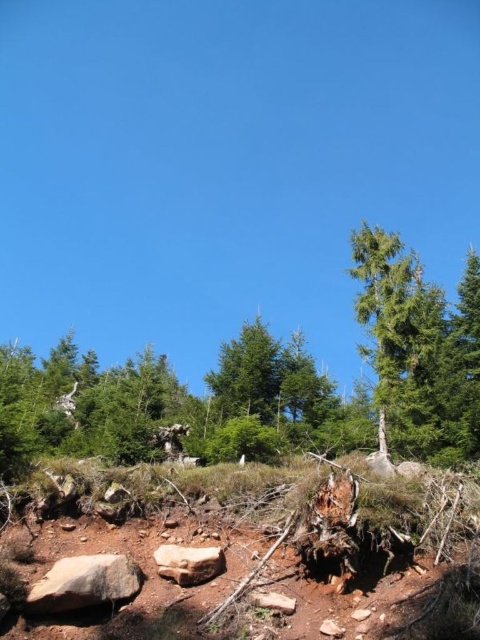
Question: Is brown dirt at center above brown rough rock at lower left?

Choices:
 (A) yes
 (B) no

Answer: (A)

Question: Is brown rough rock at lower left to the right of smooth beige rock at center from the viewer's perspective?

Choices:
 (A) yes
 (B) no

Answer: (B)

Question: Among these objects, which one is nearest to the camera?

Choices:
 (A) green textured tree at center
 (B) smooth beige rock at center

Answer: (B)

Question: Which object appears closest to the camera in this image?

Choices:
 (A) smooth beige rock at center
 (B) brown rough rock at lower left

Answer: (B)

Question: Among these points, which one is nearest to the camera?

Choices:
 (A) (208, 557)
 (B) (93, 355)

Answer: (A)

Question: Is brown dirt at center positioned before brown rough rock at lower left?

Choices:
 (A) no
 (B) yes

Answer: (A)